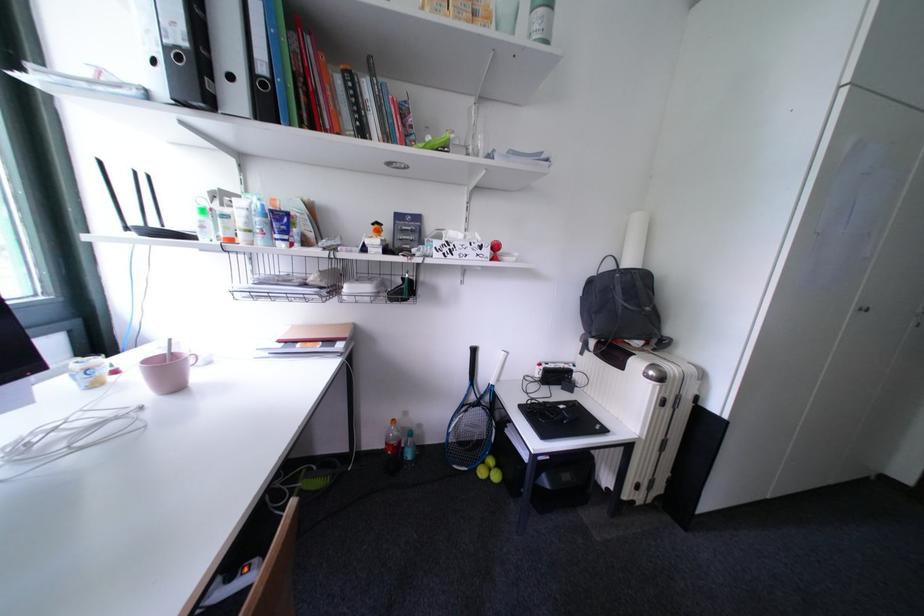
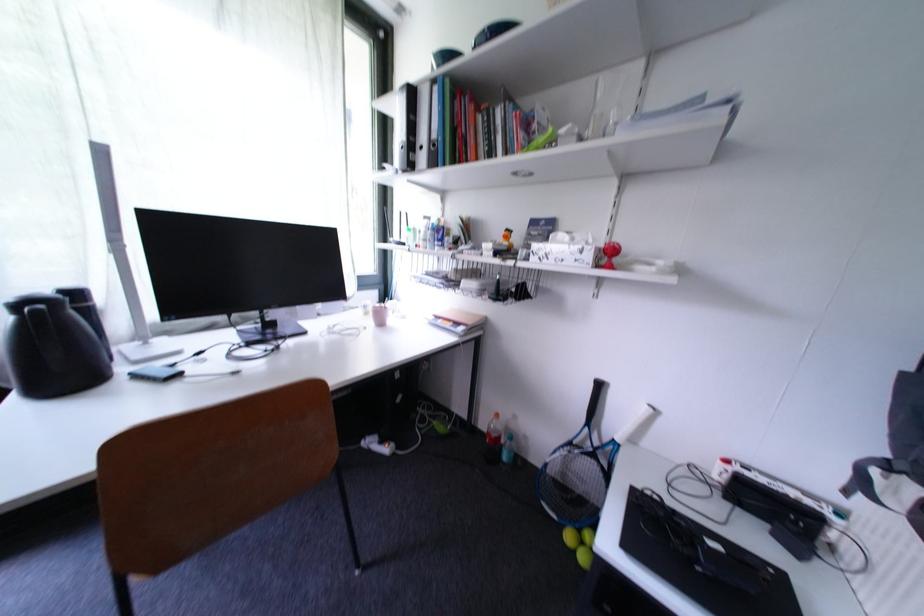
Where in the second image is the point corresponding to pixel 497 472 from the first image?

(590, 546)